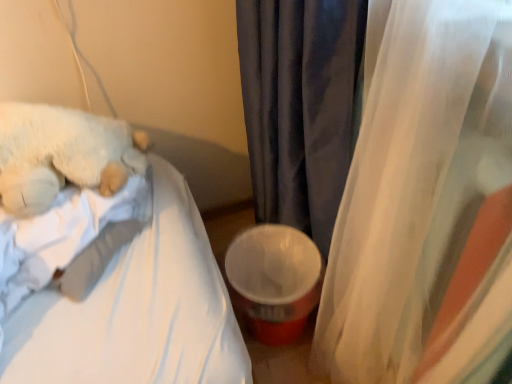
Image resolution: width=512 pixels, height=384 pixels. What do you see at coordinates (425, 203) in the screenshot?
I see `translucent fabric curtain at right, which ranks as the first curtain in right-to-left order` at bounding box center [425, 203].

In order to face translucent fabric curtain at right, which ranks as the first curtain in right-to-left order, should I rotate leftwards or rightwards?

A 27.009 degree turn to the right will do.

Locate an element on the screen. white fluffy teddy bear at left is located at coordinates (62, 154).

This screenshot has width=512, height=384. Identify the location of curtain located on the right of velvet dark gray curtain at center, acting as the second curtain starting from the right. pyautogui.click(x=425, y=203).

Is translucent fabric curtain at right, the 2th curtain from the left, not within velvet dark gray curtain at center, acting as the second curtain starting from the right?

Yes.

Is the surface of translucent fabric curtain at right, the 2th curtain from the left, in direct contact with velvet dark gray curtain at center, acting as the 1th curtain starting from the left?

No, translucent fabric curtain at right, the 2th curtain from the left, is not next to velvet dark gray curtain at center, acting as the 1th curtain starting from the left.

Which point is more distant from viewer, (479, 254) or (136, 359)?

The point (136, 359) is more distant.

From the image's perspective, would you say translucent fabric curtain at right, the 2th curtain from the left, is positioned over white soft fabric mattress at upper left?

No, from the image's perspective, translucent fabric curtain at right, the 2th curtain from the left, is not over white soft fabric mattress at upper left.

Is translucent fabric curtain at right, the 2th curtain from the left, taller than white soft fabric mattress at upper left?

Yes, translucent fabric curtain at right, the 2th curtain from the left, is taller than white soft fabric mattress at upper left.

Is translucent fabric curtain at right, which ranks as the first curtain in right-to-left order, aimed at white soft fabric mattress at upper left?

Yes, translucent fabric curtain at right, which ranks as the first curtain in right-to-left order, is oriented towards white soft fabric mattress at upper left.

Is white fluffy teddy bear at left inside the boundaries of translucent fabric curtain at right, which ranks as the first curtain in right-to-left order, or outside?

white fluffy teddy bear at left cannot be found inside translucent fabric curtain at right, which ranks as the first curtain in right-to-left order.

Between white fluffy teddy bear at left and translucent fabric curtain at right, the 2th curtain from the left, which one has more height?

translucent fabric curtain at right, the 2th curtain from the left.

From the picture: Is white fluffy teddy bear at left with translucent fabric curtain at right, the 2th curtain from the left?

white fluffy teddy bear at left is not next to translucent fabric curtain at right, the 2th curtain from the left, and they're not touching.

From a real-world perspective, between white fluffy teddy bear at left and translucent fabric curtain at right, the 2th curtain from the left, who is vertically higher?

white fluffy teddy bear at left.

From the image's perspective, is white fluffy teddy bear at left located above velvet dark gray curtain at center, acting as the second curtain starting from the right?

Yes, from the image's perspective, white fluffy teddy bear at left is over velvet dark gray curtain at center, acting as the second curtain starting from the right.

Does white fluffy teddy bear at left have a larger size compared to velvet dark gray curtain at center, acting as the 1th curtain starting from the left?

Yes.

Between white fluffy teddy bear at left and velvet dark gray curtain at center, acting as the second curtain starting from the right, which one appears on the left side from the viewer's perspective?

white fluffy teddy bear at left.

Can you see white fluffy teddy bear at left touching white soft fabric mattress at upper left?

No, white fluffy teddy bear at left is not with white soft fabric mattress at upper left.

Can you tell me how much white fluffy teddy bear at left and white soft fabric mattress at upper left differ in facing direction?

They differ by 20.7 degrees in their facing directions.

Which of these two, white fluffy teddy bear at left or white soft fabric mattress at upper left, stands shorter?

white fluffy teddy bear at left is shorter.

Is white soft fabric mattress at upper left completely or partially inside white fluffy teddy bear at left?

No, white soft fabric mattress at upper left is located outside of white fluffy teddy bear at left.

Considering the relative sizes of translucent fabric curtain at right, the 2th curtain from the left, and white fluffy teddy bear at left in the image provided, is translucent fabric curtain at right, the 2th curtain from the left, thinner than white fluffy teddy bear at left?

Indeed, translucent fabric curtain at right, the 2th curtain from the left, has a lesser width compared to white fluffy teddy bear at left.

Is point (457, 101) closer or farther from the camera than point (16, 148)?

Point (457, 101).

Who is taller, translucent fabric curtain at right, the 2th curtain from the left, or white fluffy teddy bear at left?

translucent fabric curtain at right, the 2th curtain from the left, is taller.

Is white soft fabric mattress at upper left at the back of velvet dark gray curtain at center, acting as the second curtain starting from the right?

No, velvet dark gray curtain at center, acting as the second curtain starting from the right, is not facing the opposite direction of white soft fabric mattress at upper left.

From the picture: Considering the relative positions of velvet dark gray curtain at center, acting as the 1th curtain starting from the left, and white soft fabric mattress at upper left in the image provided, is velvet dark gray curtain at center, acting as the 1th curtain starting from the left, to the right of white soft fabric mattress at upper left from the viewer's perspective?

Yes.

In terms of width, does velvet dark gray curtain at center, acting as the second curtain starting from the right, look wider or thinner when compared to white soft fabric mattress at upper left?

Clearly, velvet dark gray curtain at center, acting as the second curtain starting from the right, has less width compared to white soft fabric mattress at upper left.

Is velvet dark gray curtain at center, acting as the 1th curtain starting from the left, completely or partially outside of white soft fabric mattress at upper left?

That's correct, velvet dark gray curtain at center, acting as the 1th curtain starting from the left, is outside of white soft fabric mattress at upper left.

Where is `curtain on the right of velvet dark gray curtain at center, acting as the second curtain starting from the right`? Image resolution: width=512 pixels, height=384 pixels. curtain on the right of velvet dark gray curtain at center, acting as the second curtain starting from the right is located at coordinates (425, 203).

At what (x,y) coordinates should I click in order to perform the action: click on mattress below the translucent fabric curtain at right, the 2th curtain from the left (from a real-world perspective). Please return your answer as a coordinate pair (x, y). The height and width of the screenshot is (384, 512). Looking at the image, I should click on (140, 311).

Which object lies nearer to the anchor point velvet dark gray curtain at center, acting as the 1th curtain starting from the left, white fluffy teddy bear at left or white soft fabric mattress at upper left?

Based on the image, white soft fabric mattress at upper left appears to be nearer to velvet dark gray curtain at center, acting as the 1th curtain starting from the left.

Consider the image. Which object lies nearer to the anchor point white fluffy teddy bear at left, velvet dark gray curtain at center, acting as the second curtain starting from the right, or white soft fabric mattress at upper left?

white soft fabric mattress at upper left is positioned closer to the anchor white fluffy teddy bear at left.

From the image, which object appears to be nearer to white soft fabric mattress at upper left, velvet dark gray curtain at center, acting as the second curtain starting from the right, or white fluffy teddy bear at left?

The object closer to white soft fabric mattress at upper left is white fluffy teddy bear at left.

Estimate the real-world distances between objects in this image. Which object is further from translucent fabric curtain at right, which ranks as the first curtain in right-to-left order, white soft fabric mattress at upper left or velvet dark gray curtain at center, acting as the second curtain starting from the right?

white soft fabric mattress at upper left is positioned further to the anchor translucent fabric curtain at right, which ranks as the first curtain in right-to-left order.

Considering their positions, is white soft fabric mattress at upper left positioned closer to white fluffy teddy bear at left than translucent fabric curtain at right, the 2th curtain from the left?

white soft fabric mattress at upper left lies closer to white fluffy teddy bear at left than the other object.

Looking at the image, which one is located further to velvet dark gray curtain at center, acting as the second curtain starting from the right, white soft fabric mattress at upper left or translucent fabric curtain at right, which ranks as the first curtain in right-to-left order?

white soft fabric mattress at upper left lies further to velvet dark gray curtain at center, acting as the second curtain starting from the right, than the other object.

When comparing their distances from translucent fabric curtain at right, the 2th curtain from the left, does velvet dark gray curtain at center, acting as the second curtain starting from the right, or white soft fabric mattress at upper left seem closer?

velvet dark gray curtain at center, acting as the second curtain starting from the right.

Consider the image. Estimate the real-world distances between objects in this image. Which object is closer to velvet dark gray curtain at center, acting as the 1th curtain starting from the left, translucent fabric curtain at right, which ranks as the first curtain in right-to-left order, or white fluffy teddy bear at left?

translucent fabric curtain at right, which ranks as the first curtain in right-to-left order, is positioned closer to the anchor velvet dark gray curtain at center, acting as the 1th curtain starting from the left.

I want to click on curtain between white soft fabric mattress at upper left and translucent fabric curtain at right, which ranks as the first curtain in right-to-left order, from left to right, so click(300, 106).

Identify the location of mattress between white fluffy teddy bear at left and velvet dark gray curtain at center, acting as the second curtain starting from the right. Image resolution: width=512 pixels, height=384 pixels. (140, 311).

Locate an element on the screen. The image size is (512, 384). mattress situated between white fluffy teddy bear at left and translucent fabric curtain at right, which ranks as the first curtain in right-to-left order, from left to right is located at coordinates (140, 311).

Find the location of a particular element. The width and height of the screenshot is (512, 384). curtain located between white fluffy teddy bear at left and translucent fabric curtain at right, the 2th curtain from the left, in the left-right direction is located at coordinates (300, 106).